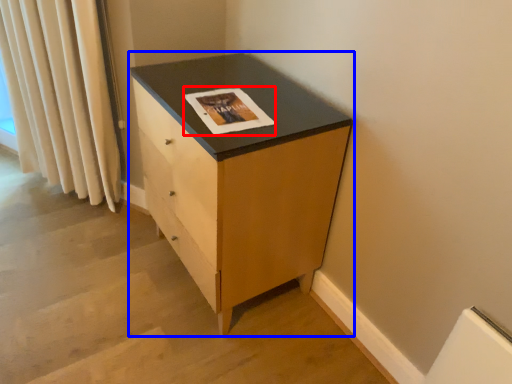
Question: Which of the following is the closest to the observer, magazine (highlighted by a red box) or chest of drawers (highlighted by a blue box)?

Choices:
 (A) magazine
 (B) chest of drawers

Answer: (B)